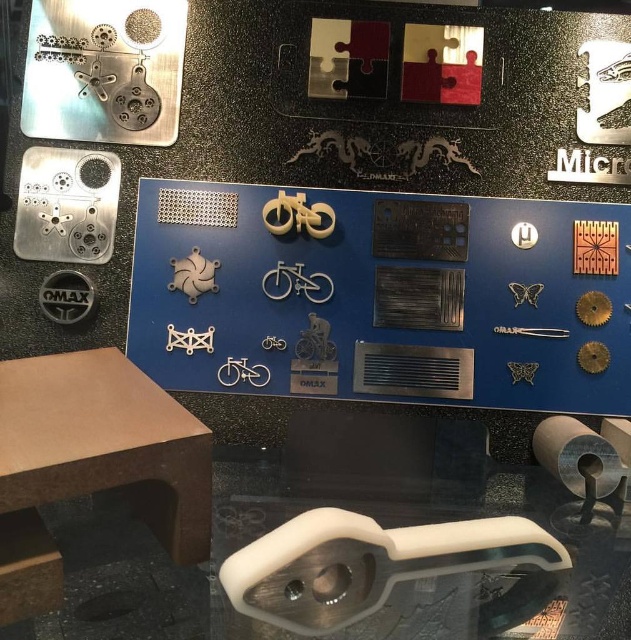
You are a museum visitor holding a flashlight. You want to shine the light on the transparent plastic handle at lower center and the brown matte table at lower left. Which object should you aim the flashlight at first to ensure both are illuminated without moving the flashlight?

You should aim the flashlight at the brown matte table at lower left first because the transparent plastic handle at lower center is positioned under it. By illuminating the table first, the light will naturally reach the handle underneath without needing to adjust the flashlight.

You are a museum visitor who wants to touch the transparent plastic handle at lower center. Based on its position, where should you look to find it?

The transparent plastic handle at lower center is located at point (221, 548), so you should look towards the lower center area of the display to find it.